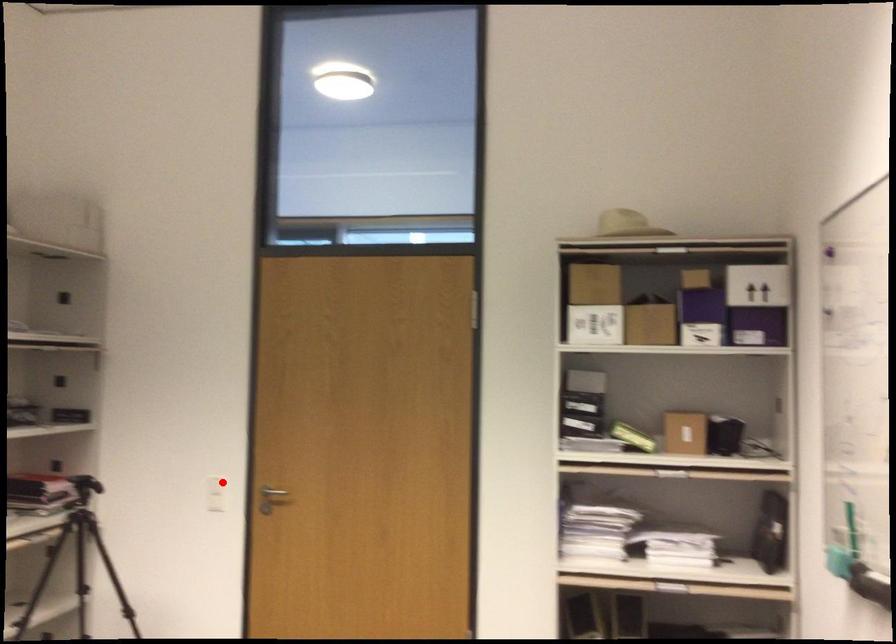
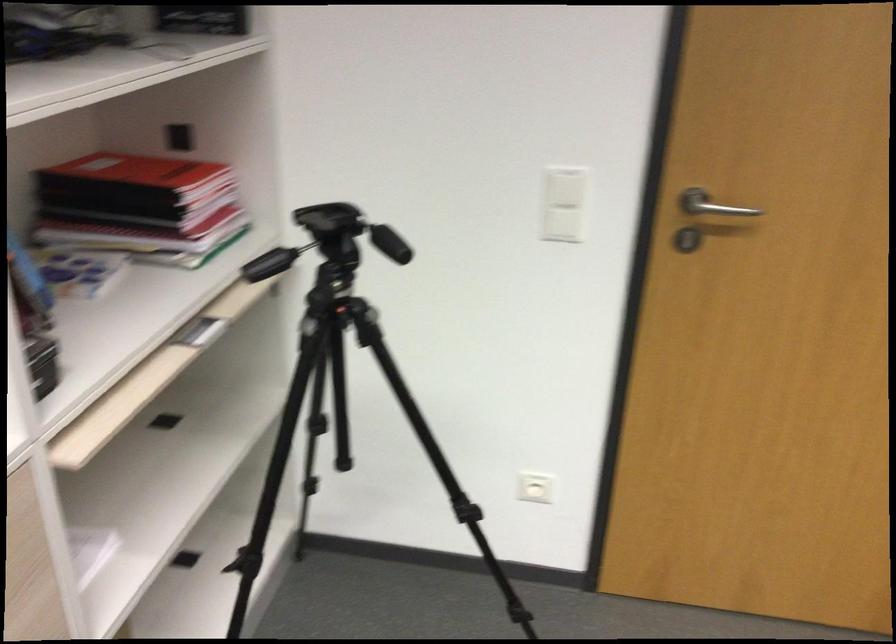
Locate, in the second image, the point that corresponds to the highlighted location in the first image.

(565, 187)